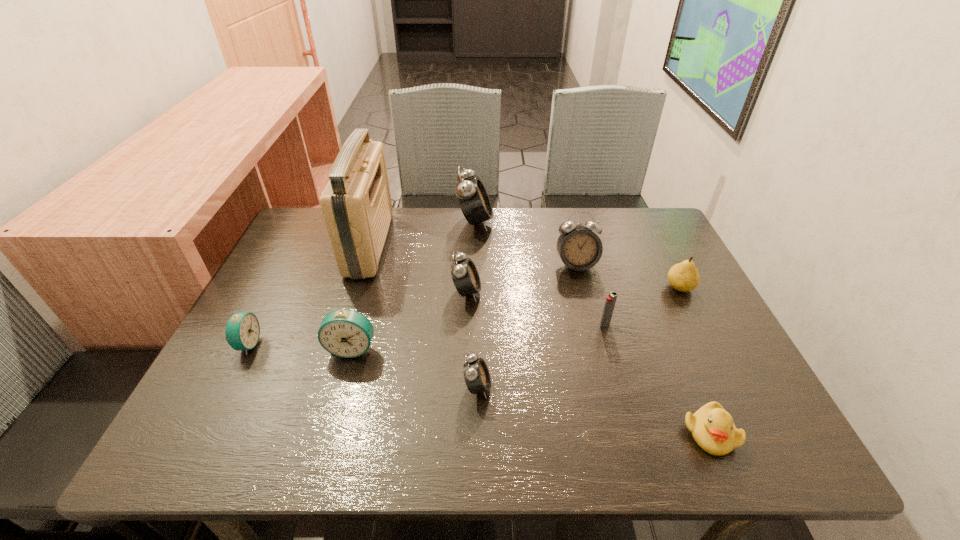
At what (x,y) coordinates should I click in order to perform the action: click on pear. Please return your answer as a coordinate pair (x, y). Looking at the image, I should click on (684, 276).

Find the location of `the sixth farthest object`. the sixth farthest object is located at coordinates (610, 301).

Find the location of a particular element. This screenshot has width=960, height=540. the leftmost object is located at coordinates (242, 331).

Where is `the leftmost alarm clock`? This screenshot has width=960, height=540. the leftmost alarm clock is located at coordinates tap(242, 331).

Find the location of a particular element. the nearest alarm clock is located at coordinates (476, 374).

Find the location of a particular element. This screenshot has height=540, width=960. the nearest white alarm clock is located at coordinates (476, 374).

Where is `the nearest object`? The height and width of the screenshot is (540, 960). the nearest object is located at coordinates (713, 429).

Find the location of `duckling`. duckling is located at coordinates (713, 429).

This screenshot has height=540, width=960. Identify the location of vacant space located on the front-facing side of the tallest object. pyautogui.click(x=498, y=245).

Locate an element on the screen. blank area located 0.150m on the face of the biggest white alarm clock is located at coordinates (541, 221).